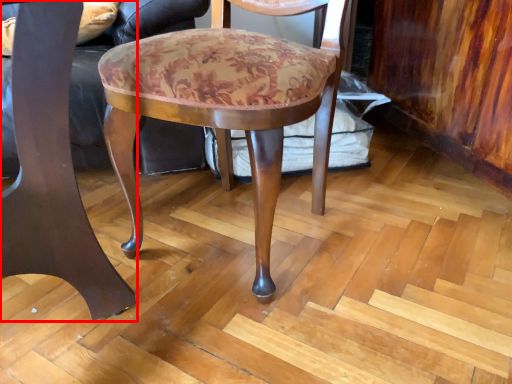
Question: In this image, where is chair (annotated by the red box) located relative to chair?

Choices:
 (A) left
 (B) right

Answer: (A)